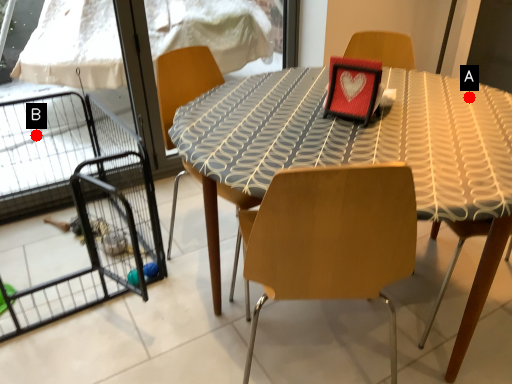
Question: Two points are circled on the image, labeled by A and B beside each circle. Which point is farther to the camera?

Choices:
 (A) A is further
 (B) B is further

Answer: (B)